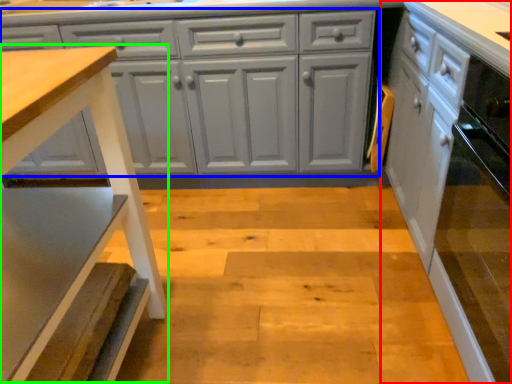
Question: Which is farther away from cabinetry (highlighted by a red box)? cabinetry (highlighted by a blue box) or step stool (highlighted by a green box)?

Choices:
 (A) cabinetry
 (B) step stool

Answer: (B)